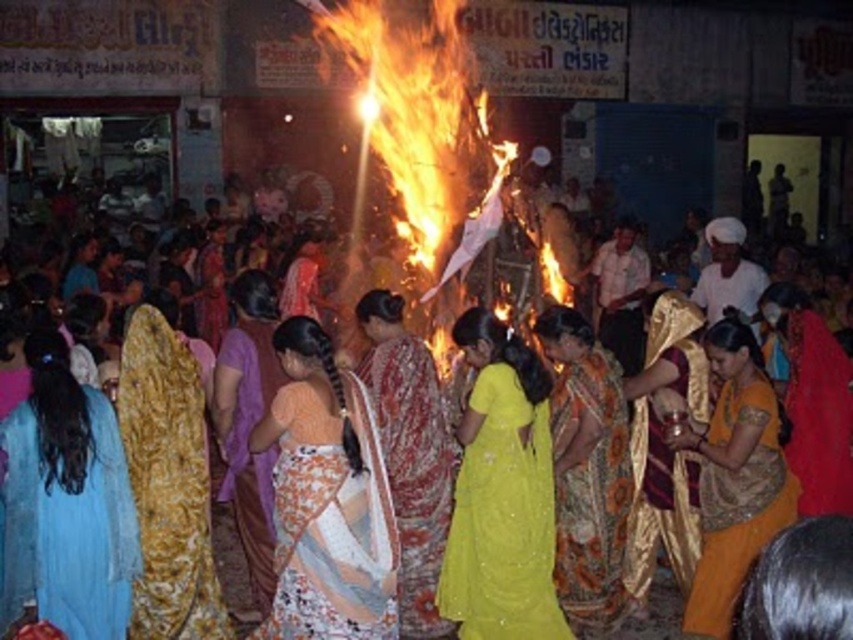
Question: Among these objects, which one is farthest from the camera?

Choices:
 (A) floral silk sari at center
 (B) yellow sequined sari at center

Answer: (A)

Question: Can you confirm if yellow sequined sari at center is positioned to the right of reddish-brown floral saree at center?

Choices:
 (A) no
 (B) yes

Answer: (B)

Question: Which object is the farthest from the floral silk sari at center?

Choices:
 (A) golden silk saree at center
 (B) reddish-brown floral saree at center
 (C) orange printed saree at center
 (D) light blue fabric at lower left

Answer: (D)

Question: Can you confirm if gold shiny saree at center is smaller than orange printed saree at center?

Choices:
 (A) no
 (B) yes

Answer: (B)

Question: From the image, what is the correct spatial relationship of yellow sequined sari at center in relation to yellow silk saree at center?

Choices:
 (A) right
 (B) left

Answer: (B)

Question: Estimate the real-world distances between objects in this image. Which object is closer to the golden textured fabric at center?

Choices:
 (A) yellow sequined sari at center
 (B) printed cotton saree at center
 (C) reddish-brown floral saree at center
 (D) light blue fabric at lower left

Answer: (D)